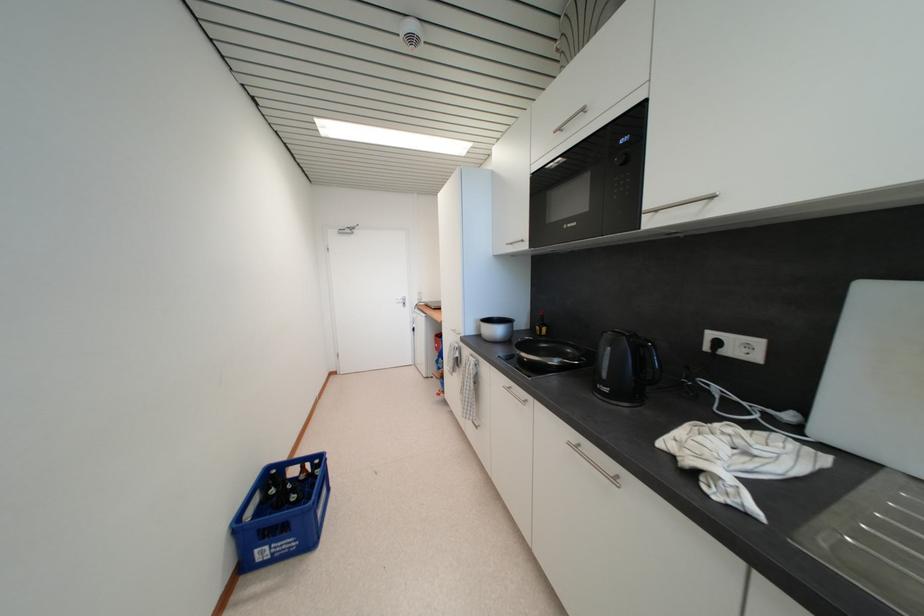
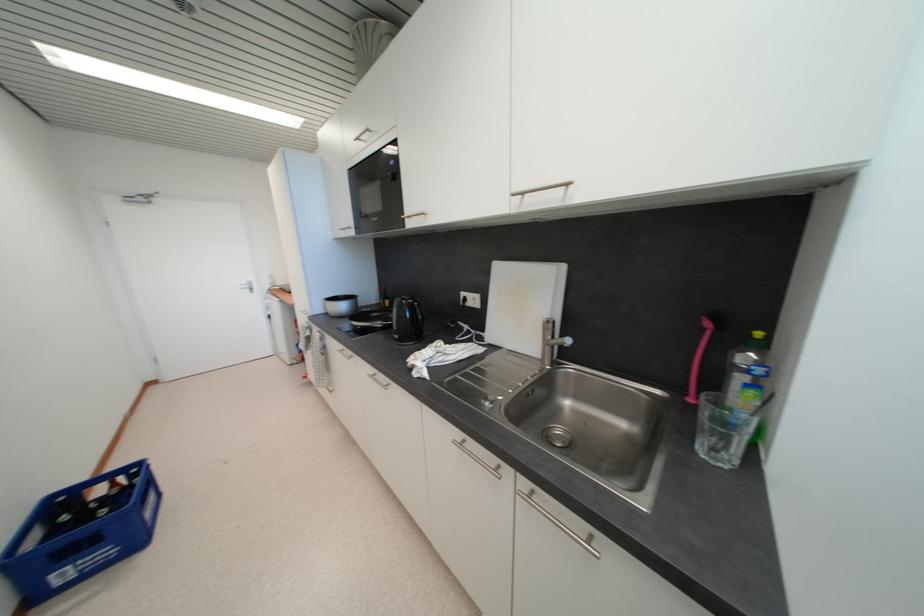
Locate, in the second image, the point that corresponds to the point at 550,328 in the first image.

(392, 301)